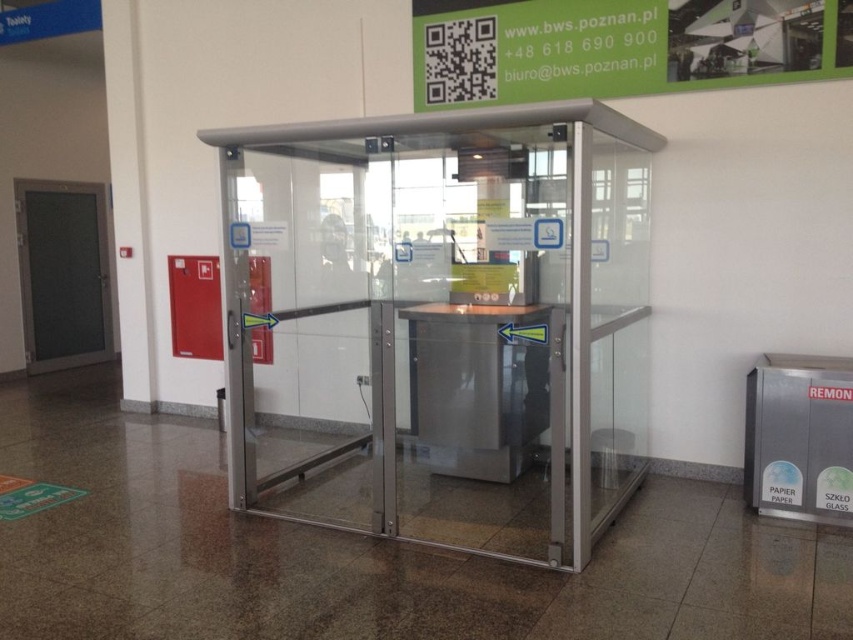
Does transparent glass door at center come behind metallic door at left?

No.

Who is taller, transparent glass door at center or metallic door at left?

transparent glass door at center is taller.

Measure the distance between point (x=639, y=444) and camera.

Point (x=639, y=444) is 4.34 meters away from camera.

Where is `transparent glass door at center`? This screenshot has width=853, height=640. transparent glass door at center is located at coordinates (440, 323).